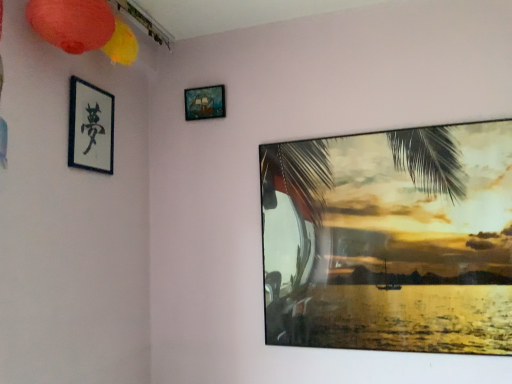
Question: Is metallic glossy picture frame at upper right, the third picture frame when ordered from left to right, looking in the opposite direction of black paper at upper left, which ranks as the 3th picture frame in right-to-left order?

Choices:
 (A) no
 (B) yes

Answer: (A)

Question: Can you confirm if metallic glossy picture frame at upper right, the third picture frame when ordered from left to right, is taller than black paper at upper left, the 1th picture frame when ordered from left to right?

Choices:
 (A) yes
 (B) no

Answer: (A)

Question: Can you confirm if metallic glossy picture frame at upper right, placed as the 1th picture frame when sorted from right to left, is bigger than black paper at upper left, the 1th picture frame when ordered from left to right?

Choices:
 (A) yes
 (B) no

Answer: (A)

Question: Can you confirm if metallic glossy picture frame at upper right, the third picture frame when ordered from left to right, is wider than black paper at upper left, which ranks as the 3th picture frame in right-to-left order?

Choices:
 (A) no
 (B) yes

Answer: (B)

Question: From the image's perspective, does metallic glossy picture frame at upper right, the third picture frame when ordered from left to right, appear higher than black paper at upper left, which ranks as the 3th picture frame in right-to-left order?

Choices:
 (A) yes
 (B) no

Answer: (B)

Question: Is metallic glossy picture frame at upper right, placed as the 1th picture frame when sorted from right to left, completely or partially outside of black paper at upper left, the 1th picture frame when ordered from left to right?

Choices:
 (A) no
 (B) yes

Answer: (B)

Question: Is black paper at upper left, which ranks as the 3th picture frame in right-to-left order, completely or partially outside of metallic glossy picture frame at upper right, placed as the 1th picture frame when sorted from right to left?

Choices:
 (A) no
 (B) yes

Answer: (B)

Question: Is metallic glossy picture frame at upper right, placed as the 1th picture frame when sorted from right to left, at the back of black paper at upper left, which ranks as the 3th picture frame in right-to-left order?

Choices:
 (A) no
 (B) yes

Answer: (A)

Question: Is black paper at upper left, the 1th picture frame when ordered from left to right, surrounding metallic glossy picture frame at upper right, placed as the 1th picture frame when sorted from right to left?

Choices:
 (A) yes
 (B) no

Answer: (B)

Question: Is black paper at upper left, the 1th picture frame when ordered from left to right, oriented towards metallic glossy picture frame at upper right, placed as the 1th picture frame when sorted from right to left?

Choices:
 (A) no
 (B) yes

Answer: (B)

Question: Can you confirm if black paper at upper left, the 1th picture frame when ordered from left to right, is positioned to the right of metallic glossy picture frame at upper right, placed as the 1th picture frame when sorted from right to left?

Choices:
 (A) no
 (B) yes

Answer: (A)

Question: Does black paper at upper left, which ranks as the 3th picture frame in right-to-left order, come in front of metallic glossy picture frame at upper right, placed as the 1th picture frame when sorted from right to left?

Choices:
 (A) no
 (B) yes

Answer: (A)

Question: From the image's perspective, does matte paper lantern at upper left appear lower than metallic glossy picture frame at upper right, placed as the 1th picture frame when sorted from right to left?

Choices:
 (A) yes
 (B) no

Answer: (B)